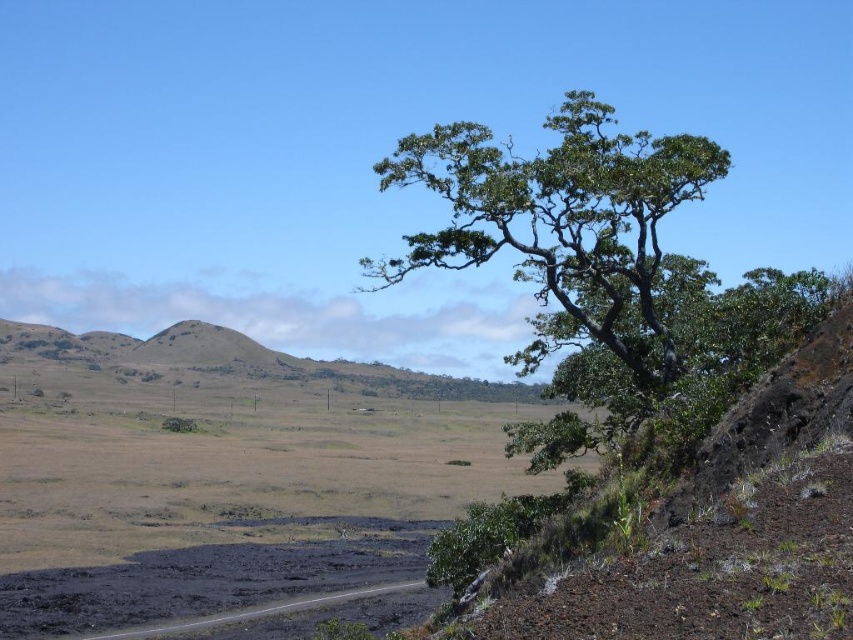
Question: Is green leafy tree at upper right in front of black asphalt road at lower left?

Choices:
 (A) yes
 (B) no

Answer: (A)

Question: Which point is closer to the camera taking this photo?

Choices:
 (A) (610, 292)
 (B) (291, 605)

Answer: (A)

Question: Does green leafy tree at upper right have a lesser width compared to black asphalt road at lower left?

Choices:
 (A) yes
 (B) no

Answer: (B)

Question: Which point is closer to the camera?

Choices:
 (A) green leafy tree at upper right
 (B) black asphalt road at lower left

Answer: (A)

Question: Is green leafy tree at upper right to the left of black asphalt road at lower left from the viewer's perspective?

Choices:
 (A) no
 (B) yes

Answer: (A)